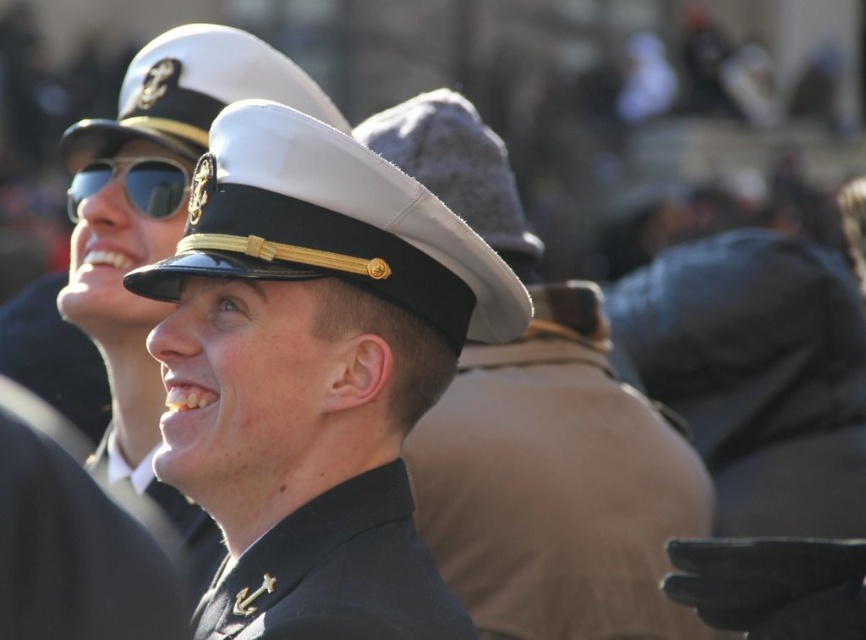
Where is the glossy white hat at center located in the image?

The glossy white hat at center is located at point 0.355 on the x axis and 0.386 on the y axis.

Looking at this image, you are a photographer at the event and need to position a light source to the right of the glossy black hat at center. Based on the coordinates provided, where should you place the light source relative to the hat?

The glossy black hat at center is located at point [315,372]. To place the light source to the right of it, position it at coordinates with an x value greater than 0.584 and the same y value of 0.365.

You are a photographer at a military event and want to capture a clear photo of both the glossy white hat at center and the fuzzy gray hat at center. Which hat will appear larger in the photo?

The glossy white hat at center will appear larger in the photo because it is closer to the viewer than the fuzzy gray hat at center.